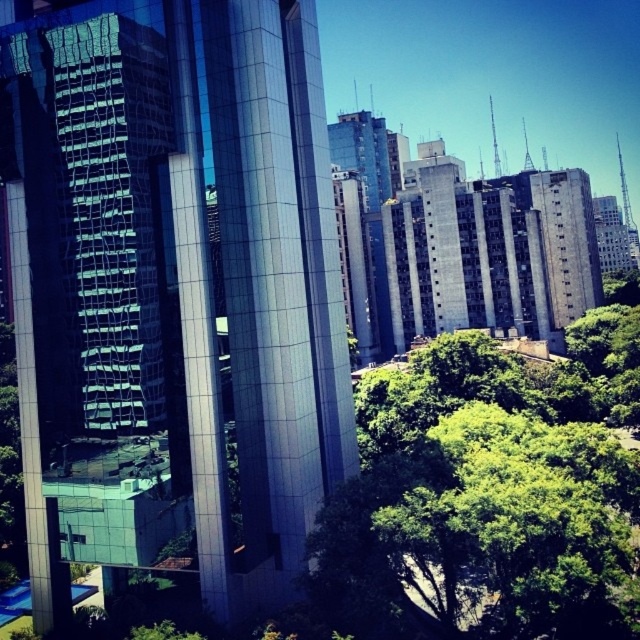
Who is more distant from viewer, (177, 289) or (326, 508)?

The point (177, 289) is behind.

Between glossy glass building at center and green leafy tree at center, which one has less height?

Standing shorter between the two is green leafy tree at center.

Where is `glossy glass building at center`? glossy glass building at center is located at coordinates (176, 278).